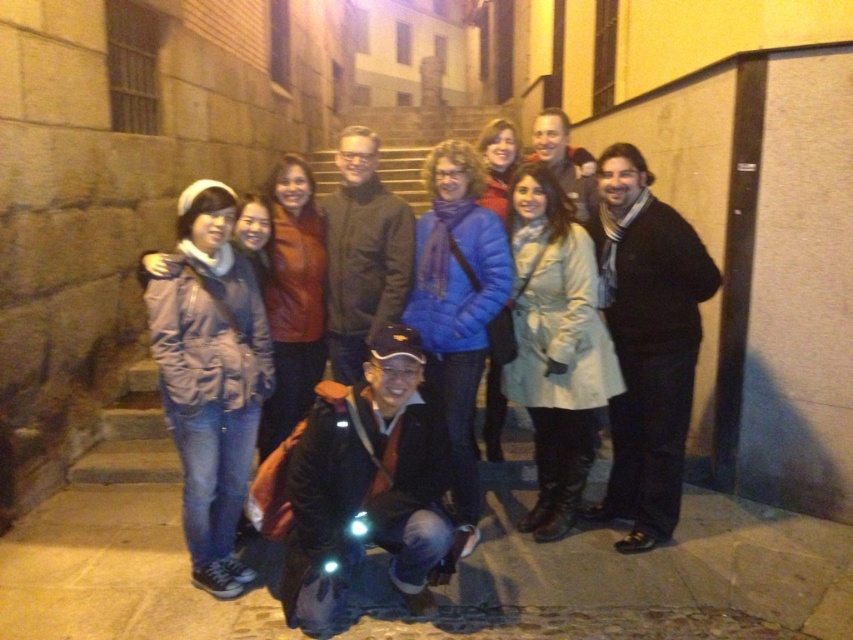
Question: Can you confirm if matte purple jacket at left is bigger than black wool scarf at right?

Choices:
 (A) no
 (B) yes

Answer: (A)

Question: In this image, where is dark brown leather jacket at center located relative to matte brown leather jacket at center?

Choices:
 (A) above
 (B) below

Answer: (A)

Question: Which object is the closest to the black wool scarf at right?

Choices:
 (A) white matte coat at center
 (B) dark blue jacket at center
 (C) matte brown leather jacket at center
 (D) matte black jacket at center

Answer: (A)

Question: Which point is closer to the camera?

Choices:
 (A) (302, 168)
 (B) (341, 362)
 (C) (265, 349)
 (D) (421, 349)

Answer: (D)

Question: Which object is positioned farthest from the dark brown leather jacket at center?

Choices:
 (A) white matte coat at center
 (B) dark blue jacket at center
 (C) matte brown leather jacket at center

Answer: (B)

Question: Is matte brown leather jacket at center below matte black jacket at center?

Choices:
 (A) yes
 (B) no

Answer: (A)